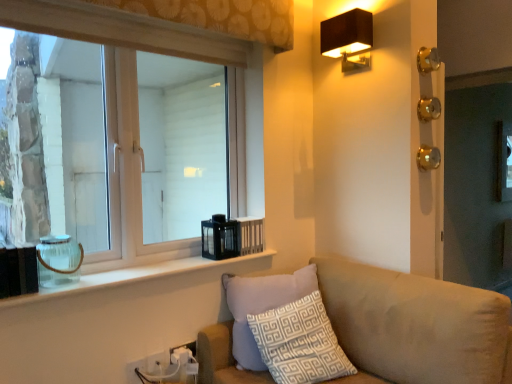
Question: Which direction should I rotate to look at white plastic electric outlet at lower center, which ranks as the 2th electric outlet in right-to-left order, — up or down?

Choices:
 (A) up
 (B) down

Answer: (B)

Question: Can you confirm if beige fabric couch at lower right is wider than white patterned cushion at lower center?

Choices:
 (A) yes
 (B) no

Answer: (A)

Question: Is beige fabric couch at lower right taller than white patterned cushion at lower center?

Choices:
 (A) yes
 (B) no

Answer: (A)

Question: From the image's perspective, does beige fabric couch at lower right appear lower than white patterned cushion at lower center?

Choices:
 (A) yes
 (B) no

Answer: (A)

Question: Is beige fabric couch at lower right positioned behind white patterned cushion at lower center?

Choices:
 (A) yes
 (B) no

Answer: (B)

Question: Is beige fabric couch at lower right oriented away from white patterned cushion at lower center?

Choices:
 (A) no
 (B) yes

Answer: (B)

Question: Does beige fabric couch at lower right have a larger size compared to white patterned cushion at lower center?

Choices:
 (A) yes
 (B) no

Answer: (A)

Question: Does white plastic electric outlet at lower left, the first electric outlet from the front, have a greater height compared to clear glass jar at lower left?

Choices:
 (A) no
 (B) yes

Answer: (B)

Question: Is white plastic electric outlet at lower left, positioned as the 3th electric outlet in back-to-front order, further to the viewer compared to clear glass jar at lower left?

Choices:
 (A) yes
 (B) no

Answer: (A)

Question: From a real-world perspective, is white plastic electric outlet at lower left, positioned as the 3th electric outlet in back-to-front order, located beneath clear glass jar at lower left?

Choices:
 (A) yes
 (B) no

Answer: (A)

Question: Does white plastic electric outlet at lower left, the first electric outlet from the front, appear on the right side of clear glass jar at lower left?

Choices:
 (A) no
 (B) yes

Answer: (A)

Question: Is white plastic electric outlet at lower left, which is counted as the 1th electric outlet, starting from the left, next to clear glass jar at lower left and touching it?

Choices:
 (A) no
 (B) yes

Answer: (A)

Question: Is white plastic electric outlet at lower left, the first electric outlet from the front, far from clear glass jar at lower left?

Choices:
 (A) no
 (B) yes

Answer: (A)

Question: Does clear glass jar at left have a smaller size compared to white patterned cushion at lower center?

Choices:
 (A) yes
 (B) no

Answer: (A)